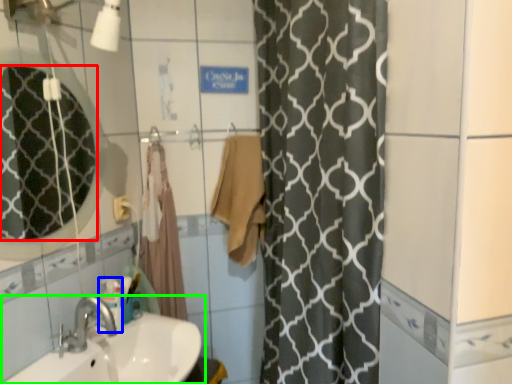
Question: Which is nearer to the mirror (highlighted by a red box)? toiletry (highlighted by a blue box) or sink (highlighted by a green box).

Choices:
 (A) toiletry
 (B) sink

Answer: (A)